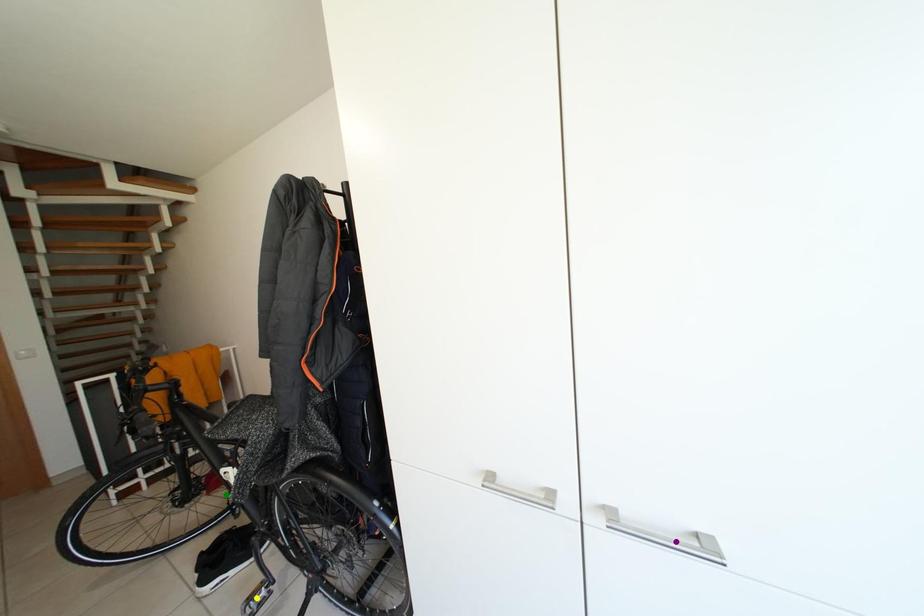
Order these from nearest to farthest:
1. yellow point
2. purple point
3. green point

green point
yellow point
purple point